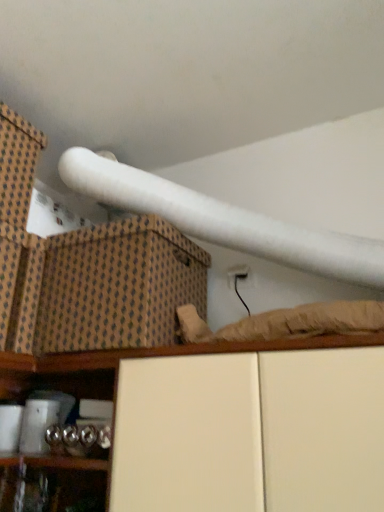
Question: Considering the positions of brown textured cardboard box at upper left and white matte cabinet at lower center in the image, is brown textured cardboard box at upper left bigger or smaller than white matte cabinet at lower center?

Choices:
 (A) big
 (B) small

Answer: (B)

Question: Looking at their shapes, would you say brown textured cardboard box at upper left is wider or thinner than white matte cabinet at lower center?

Choices:
 (A) wide
 (B) thin

Answer: (A)

Question: Estimate the real-world distances between objects in this image. Which object is farther from the brown textured cardboard box at upper left?

Choices:
 (A) white matte cabinet at lower center
 (B) brown woven box at upper left

Answer: (B)

Question: Considering the real-world distances, which object is farthest from the brown textured cardboard box at upper left?

Choices:
 (A) brown woven box at upper left
 (B) white matte cabinet at lower center

Answer: (A)